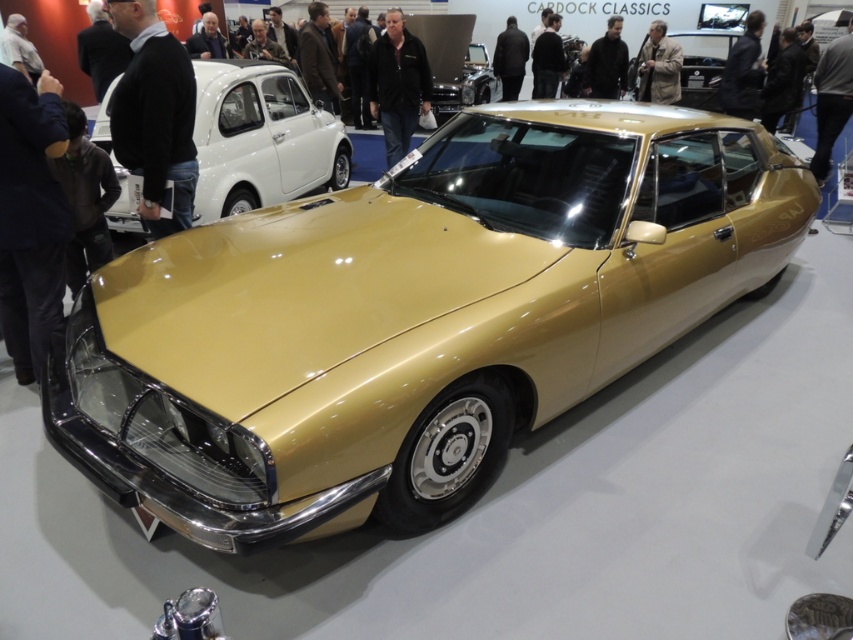
Question: Among these points, which one is farthest from the camera?

Choices:
 (A) (460, 100)
 (B) (755, 92)

Answer: (A)

Question: Considering the relative positions of black fabric jacket at upper center and white fabric shirt at upper left in the image provided, where is black fabric jacket at upper center located with respect to white fabric shirt at upper left?

Choices:
 (A) right
 (B) left

Answer: (A)

Question: Which object appears farthest from the camera in this image?

Choices:
 (A) black leather jacket at center
 (B) dark brown leather jacket at center

Answer: (B)

Question: Is dark brown leather jacket at center to the right of gray hair at upper center from the viewer's perspective?

Choices:
 (A) yes
 (B) no

Answer: (A)

Question: Can you confirm if black leather jacket at upper center is wider than black fabric jacket at upper center?

Choices:
 (A) no
 (B) yes

Answer: (A)

Question: Among these points, which one is nearest to the camera?

Choices:
 (A) (675, 100)
 (B) (758, 72)
 (C) (207, 19)
 (D) (845, 80)

Answer: (D)